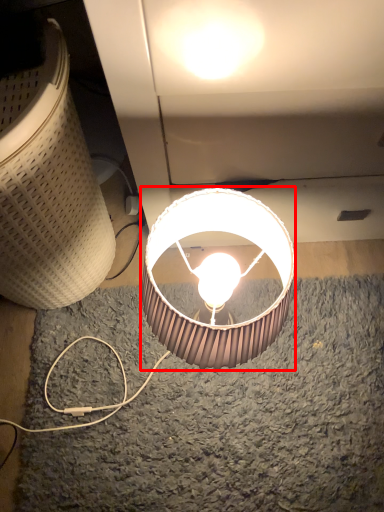
Question: From the image's perspective, what is the correct spatial relationship of lamp (annotated by the red box) in relation to lamp?

Choices:
 (A) above
 (B) below

Answer: (B)